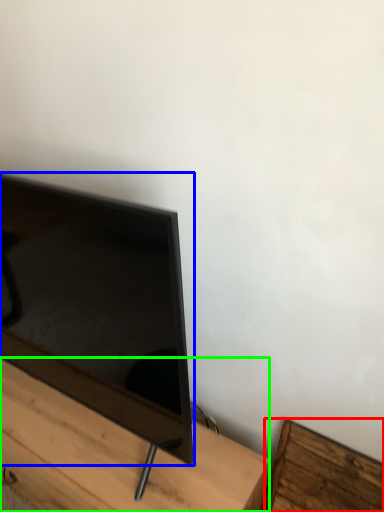
Question: Estimate the real-world distances between objects in this image. Which object is farther from furniture (highlighted by a red box), television (highlighted by a blue box) or furniture (highlighted by a green box)?

Choices:
 (A) television
 (B) furniture

Answer: (A)